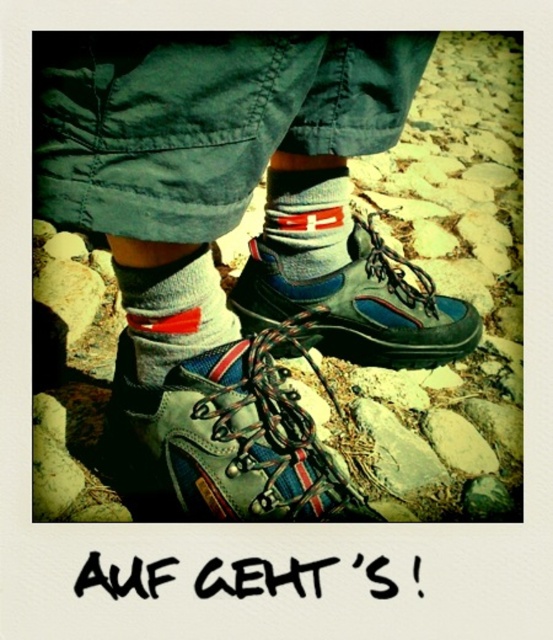
You are a photographer trying to capture the details of the gray cotton sock at center and the matte gray hiking boots at center. Since you want to focus on the sock first, which object should you adjust your camera to point slightly to the right of?

The gray cotton sock at center is to the right of the matte gray hiking boots at center. Therefore, to focus on the sock first, you should adjust your camera to point slightly to the right of the matte gray hiking boots at center.

You are a photographer trying to capture the texture of both the leather hiking boot at center and the blue suede hiking boot at center. Since they are overlapping, which boot should you focus on first to ensure the other is still visible in the photo?

The leather hiking boot at center is positioned under the blue suede hiking boot at center, so you should focus on the blue suede hiking boot at center first to ensure the lower boot remains visible.

You are trying to determine which of the two hiking boots you are wearing is shorter. You see the leather hiking boot at center and the blue suede hiking boot at center. Which one is shorter?

The leather hiking boot at center is not as tall as the blue suede hiking boot at center, so the leather hiking boot at center is shorter.